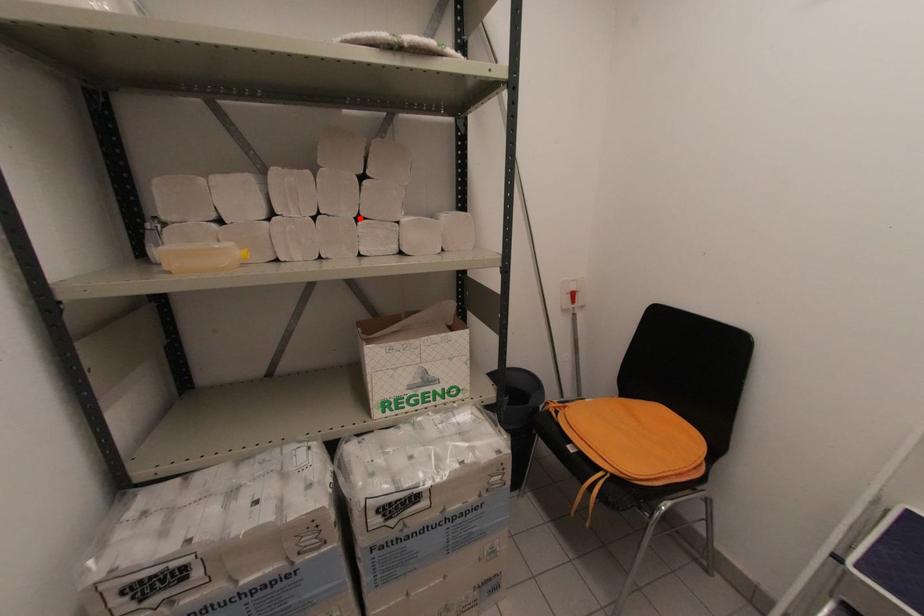
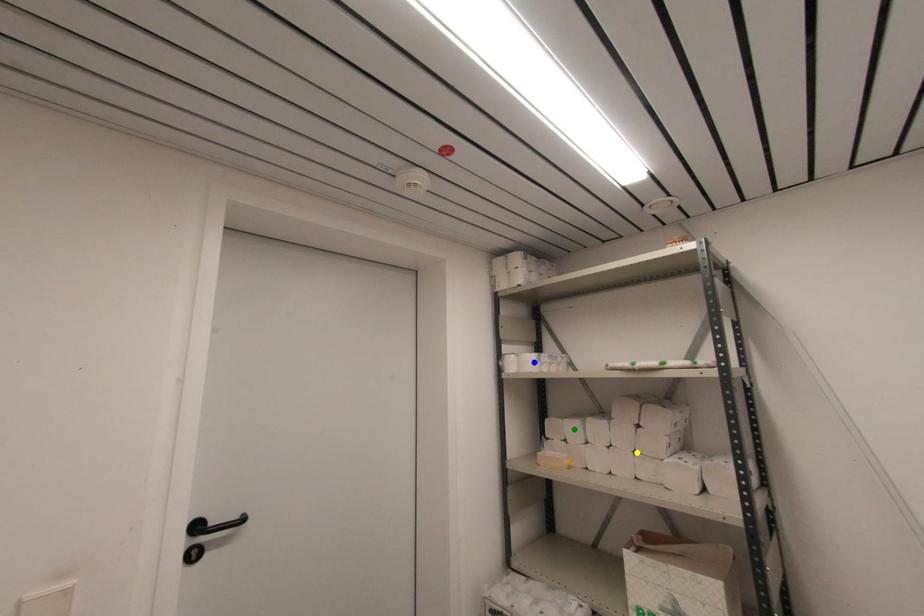
Question: I am providing you with two images of the same scene from different viewpoints. A red point is marked on the first image. You are given multiple points on the second image. Which mark in image 2 goes with the point in image 1?

Choices:
 (A) green point
 (B) blue point
 (C) yellow point

Answer: (C)